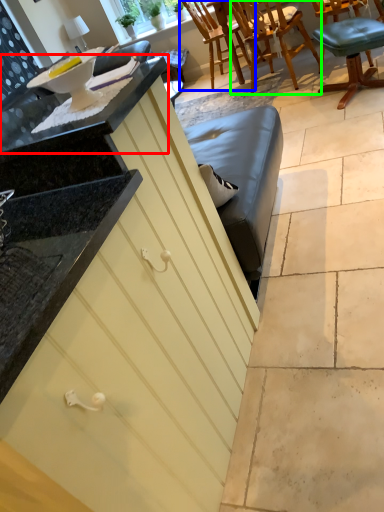
Question: Which object is positioned farthest from countertop (highlighted by a red box)? Select from chair (highlighted by a blue box) and chair (highlighted by a green box).

Choices:
 (A) chair
 (B) chair

Answer: (A)